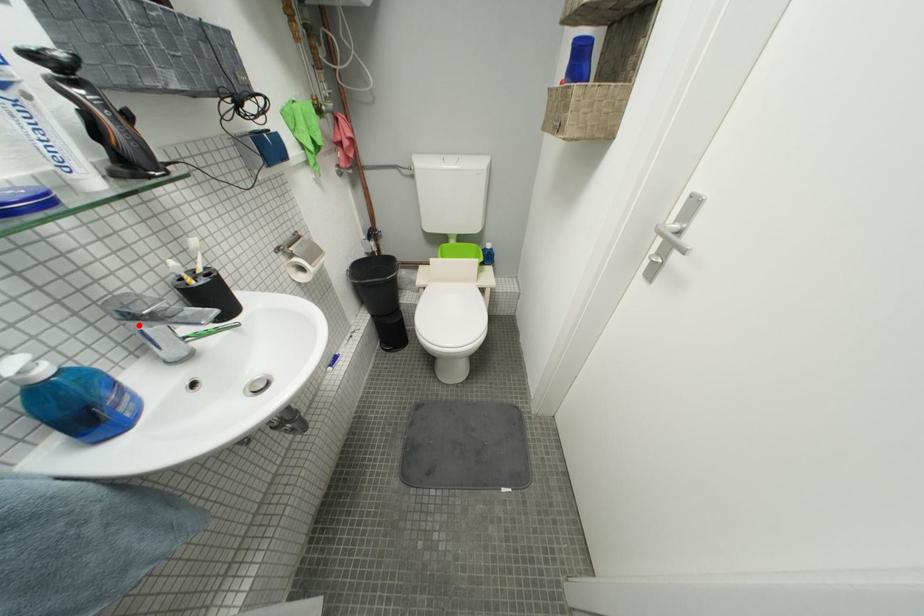
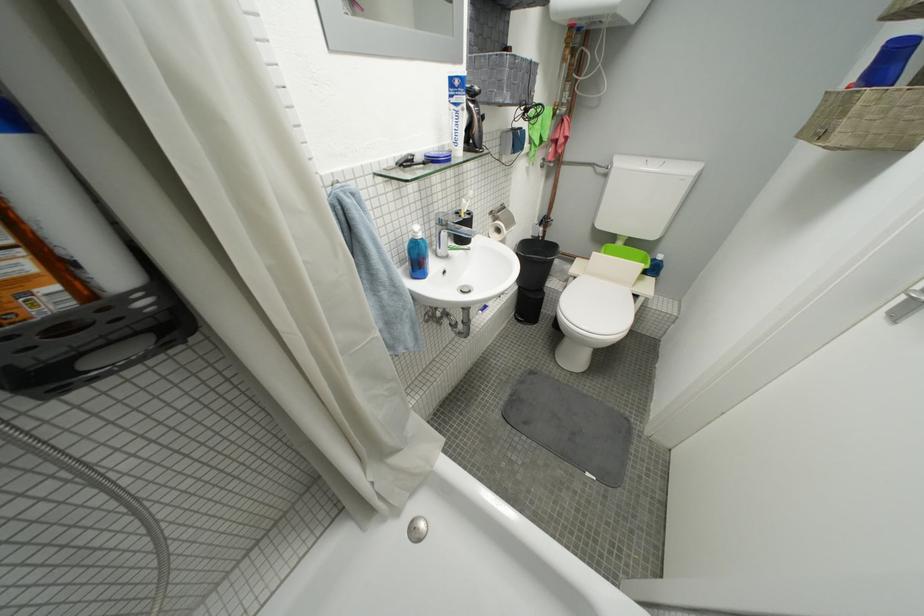
Question: A red point is marked in image1. In image2, is the corresponding 3D point closer to the camera or farther? Reply with the corresponding letter.

Choices:
 (A) The corresponding 3D point is closer.
 (B) The corresponding 3D point is farther.

Answer: (A)